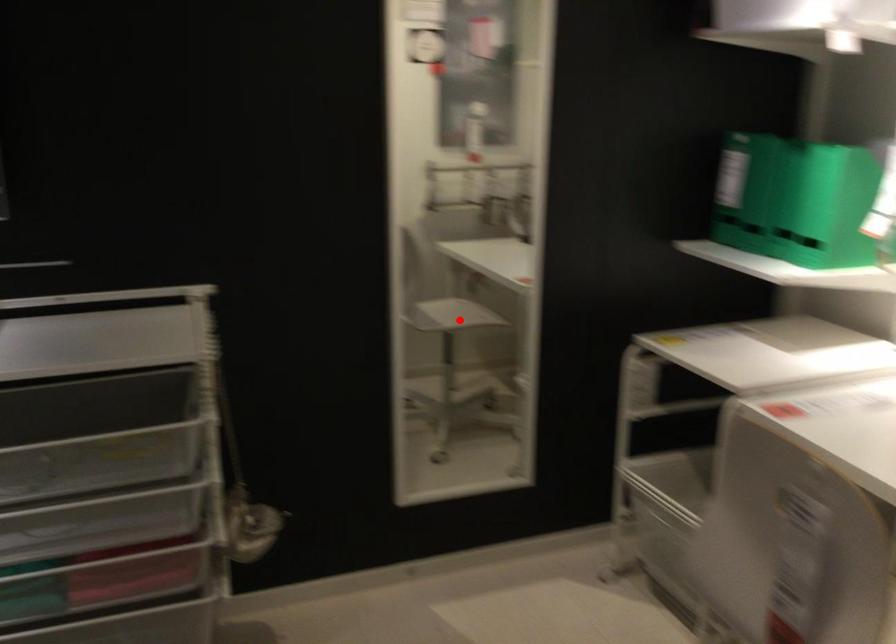
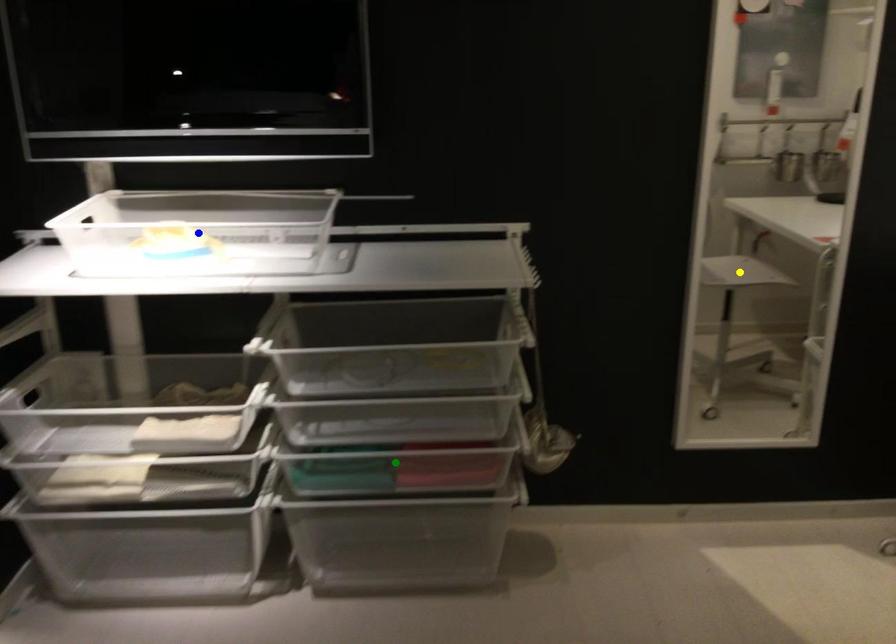
Question: I am providing you with two images of the same scene from different viewpoints. A red point is marked on the first image. You are given multiple points on the second image. Which spot in image 2 lines up with the point in image 1?

Choices:
 (A) green point
 (B) yellow point
 (C) blue point

Answer: (B)